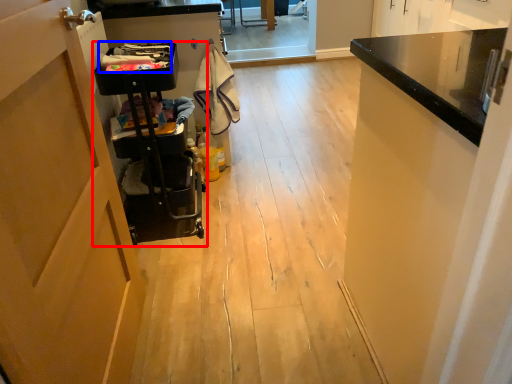
Question: Which object appears closest to the camera in this image, trolley (highlighted by a red box) or laundry (highlighted by a blue box)?

Choices:
 (A) trolley
 (B) laundry

Answer: (A)